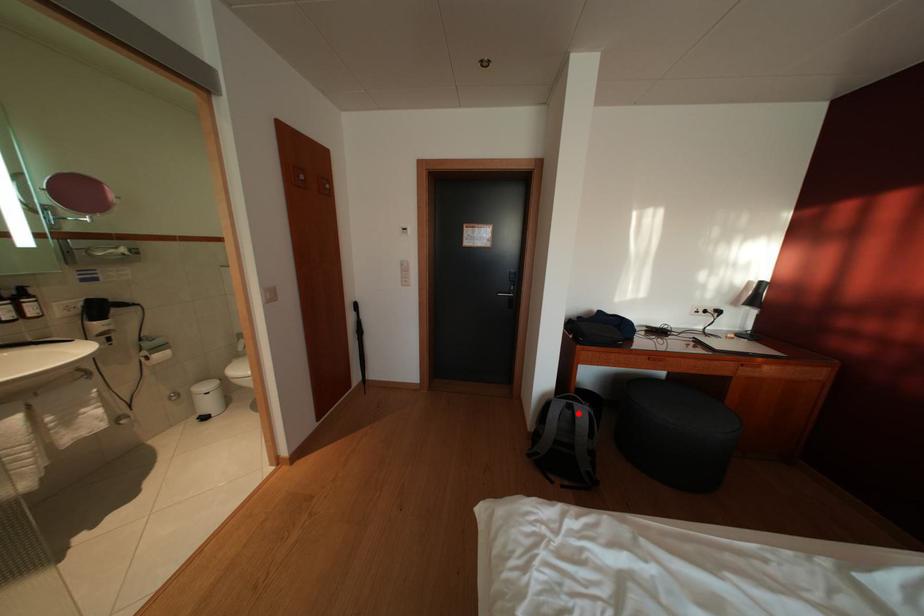
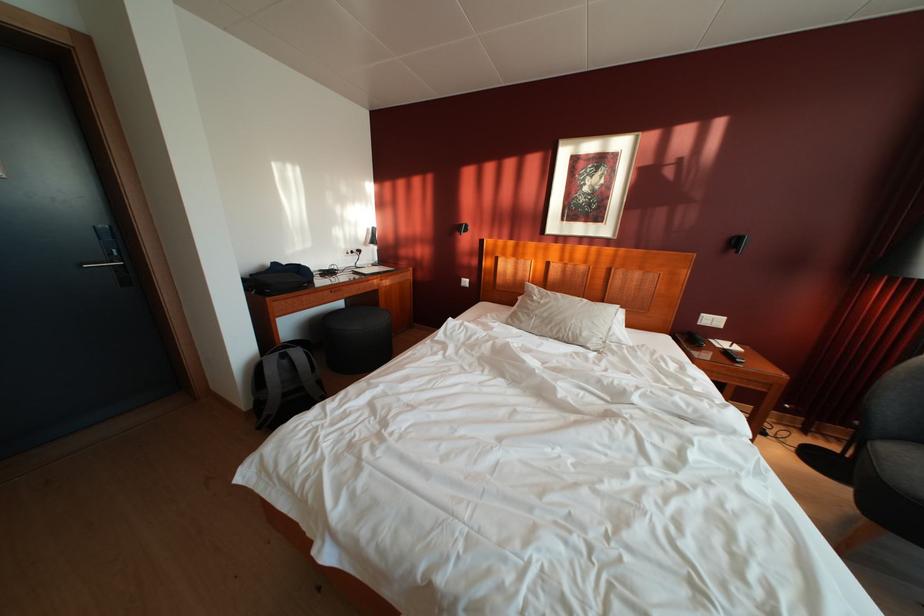
Locate, in the second image, the point that corresponds to the highlighted location in the first image.

(293, 362)